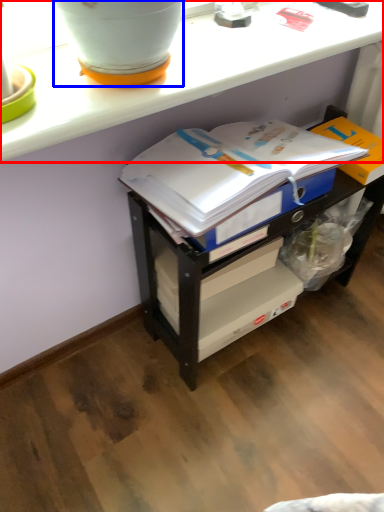
Question: Which point is closer to the camera, counter (highlighted by a red box) or flowerpot (highlighted by a blue box)?

Choices:
 (A) counter
 (B) flowerpot

Answer: (B)